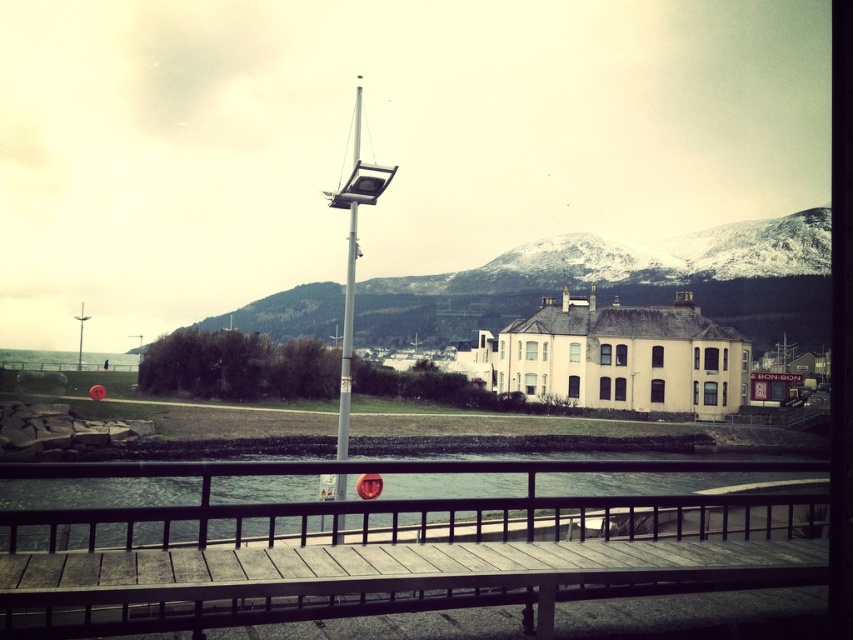
Is transparent glass water at lower center wider than silver metallic pole at center?

Correct, the width of transparent glass water at lower center exceeds that of silver metallic pole at center.

In the scene shown: Is the position of transparent glass water at lower center less distant than that of silver metallic pole at center?

That is True.

Does point (653, 465) come behind point (345, 282)?

No, (653, 465) is in front of (345, 282).

The width and height of the screenshot is (853, 640). I want to click on transparent glass water at lower center, so click(x=393, y=506).

Can you confirm if wooden dock at center is positioned below snowy rock formation at center?

Yes, wooden dock at center is below snowy rock formation at center.

Between point (181, 595) and point (578, 262), which one is positioned in front?

Point (181, 595) is in front.

Which is in front, point (135, 586) or point (390, 296)?

Positioned in front is point (135, 586).

At what (x,y) coordinates should I click in order to perform the action: click on wooden dock at center. Please return your answer as a coordinate pair (x, y). The width and height of the screenshot is (853, 640). Looking at the image, I should click on point(390,557).

Does transparent glass water at lower center lie in front of snowy rock formation at center?

Yes, it is.

Measure the distance between point (256, 506) and camera.

The distance of point (256, 506) from camera is 15.69 meters.

You are a GUI agent. You are given a task and a screenshot of the screen. Output one action in this format:
    pyautogui.click(x=<x>, y=<y>)
    Task: Click on the transparent glass water at lower center
    
    Given the screenshot: What is the action you would take?
    pyautogui.click(x=393, y=506)